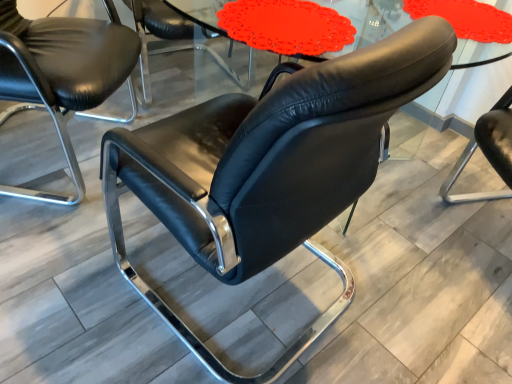
What do you see at coordinates (200, 12) in the screenshot?
I see `matte glass table at center` at bounding box center [200, 12].

What do you see at coordinates (270, 168) in the screenshot?
I see `black leather chair at center, arranged as the 3th chair when viewed from the back` at bounding box center [270, 168].

This screenshot has height=384, width=512. I want to click on matte glass table at center, so click(200, 12).

Does point (279, 59) lie in front of point (194, 46)?

No, it is behind (194, 46).

Between matte glass table at center and black leather chair at center, the third chair in the front-to-back sequence, which one has smaller size?

matte glass table at center is smaller.

Considering the positions of objects matte glass table at center and black leather chair at center, arranged as the 1th chair when viewed from the back, in the image provided, who is in front, matte glass table at center or black leather chair at center, arranged as the 1th chair when viewed from the back,?

matte glass table at center is more forward.

Which is more to the left, black leather chair at left, arranged as the second chair when viewed from the back, or black leather chair at center, arranged as the 1th chair when viewed from the back?

Positioned to the left is black leather chair at left, arranged as the second chair when viewed from the back.

Is black leather chair at left, arranged as the second chair when viewed from the front, turned away from black leather chair at center, the third chair in the front-to-back sequence?

black leather chair at left, arranged as the second chair when viewed from the front, does not have its back to black leather chair at center, the third chair in the front-to-back sequence.

From the image's perspective, is black leather chair at left, arranged as the second chair when viewed from the back, above or below black leather chair at center, the third chair in the front-to-back sequence?

black leather chair at left, arranged as the second chair when viewed from the back, is situated lower than black leather chair at center, the third chair in the front-to-back sequence, in the image.

Where is `the 1st chair below the black leather chair at center, the third chair in the front-to-back sequence (from the image's perspective)`? Image resolution: width=512 pixels, height=384 pixels. the 1st chair below the black leather chair at center, the third chair in the front-to-back sequence (from the image's perspective) is located at coordinates (62, 73).

Between black leather chair at center, arranged as the 3th chair when viewed from the back, and black leather chair at left, arranged as the second chair when viewed from the front, which one has larger width?

Wider between the two is black leather chair at center, arranged as the 3th chair when viewed from the back.

Is black leather chair at center, the 1th chair viewed from the front, turned away from black leather chair at left, arranged as the second chair when viewed from the back?

That's not correct — black leather chair at center, the 1th chair viewed from the front, is not looking away from black leather chair at left, arranged as the second chair when viewed from the back.

Considering the relative positions of black leather chair at center, the 1th chair viewed from the front, and black leather chair at left, arranged as the second chair when viewed from the front, in the image provided, is black leather chair at center, the 1th chair viewed from the front, to the right of black leather chair at left, arranged as the second chair when viewed from the front, from the viewer's perspective?

Indeed, black leather chair at center, the 1th chair viewed from the front, is positioned on the right side of black leather chair at left, arranged as the second chair when viewed from the front.

Does point (335, 311) come behind point (0, 35)?

No, it is not.

From the picture: Between black leather chair at center, the third chair in the front-to-back sequence, and black leather chair at center, arranged as the 3th chair when viewed from the back, which one has larger size?

Bigger between the two is black leather chair at center, arranged as the 3th chair when viewed from the back.

Does black leather chair at center, arranged as the 1th chair when viewed from the back, have a lesser width compared to black leather chair at center, the 1th chair viewed from the front?

Indeed, black leather chair at center, arranged as the 1th chair when viewed from the back, has a lesser width compared to black leather chair at center, the 1th chair viewed from the front.

From the image's perspective, starting from the black leather chair at center, arranged as the 3th chair when viewed from the back, which chair is the 2nd one above? Please provide its 2D coordinates.

[(172, 38)]

Is black leather chair at center, the third chair in the front-to-back sequence, at the left side of black leather chair at center, arranged as the 3th chair when viewed from the back?

Correct, you'll find black leather chair at center, the third chair in the front-to-back sequence, to the left of black leather chair at center, arranged as the 3th chair when viewed from the back.

Is black leather chair at left, arranged as the second chair when viewed from the back, shorter than matte glass table at center?

Incorrect, the height of black leather chair at left, arranged as the second chair when viewed from the back, does not fall short of that of matte glass table at center.

Are black leather chair at left, arranged as the second chair when viewed from the front, and matte glass table at center making contact?

They are not placed beside each other.

Can matte glass table at center be found inside black leather chair at left, arranged as the second chair when viewed from the back?

No, matte glass table at center is not inside black leather chair at left, arranged as the second chair when viewed from the back.

Which is behind, point (178, 9) or point (19, 86)?

Point (178, 9)

Between matte glass table at center and black leather chair at left, arranged as the second chair when viewed from the front, which one has larger width?

Wider between the two is black leather chair at left, arranged as the second chair when viewed from the front.

Does matte glass table at center have a lesser height compared to black leather chair at left, arranged as the second chair when viewed from the front?

Yes.

Is matte glass table at center closer to the viewer compared to black leather chair at left, arranged as the second chair when viewed from the back?

Yes, matte glass table at center is in front of black leather chair at left, arranged as the second chair when viewed from the back.

Which is more to the right, black leather chair at center, arranged as the 1th chair when viewed from the back, or black leather chair at left, arranged as the second chair when viewed from the back?

From the viewer's perspective, black leather chair at center, arranged as the 1th chair when viewed from the back, appears more on the right side.

Do you think black leather chair at center, arranged as the 1th chair when viewed from the back, is within black leather chair at left, arranged as the second chair when viewed from the front, or outside of it?

The correct answer is: outside.

From a real-world perspective, relative to black leather chair at left, arranged as the second chair when viewed from the front, is black leather chair at center, the third chair in the front-to-back sequence, vertically above or below?

From a real-world perspective, black leather chair at center, the third chair in the front-to-back sequence, is physically below black leather chair at left, arranged as the second chair when viewed from the front.

Where is `round table in front of the black leather chair at center, the third chair in the front-to-back sequence`? This screenshot has width=512, height=384. round table in front of the black leather chair at center, the third chair in the front-to-back sequence is located at coordinates (200, 12).

From the image's perspective, which chair is the 1st one below the black leather chair at center, arranged as the 1th chair when viewed from the back? Please provide its 2D coordinates.

[(62, 73)]

When comparing their distances from black leather chair at center, arranged as the 3th chair when viewed from the back, does black leather chair at left, arranged as the second chair when viewed from the front, or black leather chair at center, arranged as the 1th chair when viewed from the back, seem further?

The object further to black leather chair at center, arranged as the 3th chair when viewed from the back, is black leather chair at center, arranged as the 1th chair when viewed from the back.

From the image, which object appears to be farther from matte glass table at center, black leather chair at center, arranged as the 1th chair when viewed from the back, or black leather chair at left, arranged as the second chair when viewed from the front?

black leather chair at left, arranged as the second chair when viewed from the front, lies further to matte glass table at center than the other object.

When comparing their distances from black leather chair at center, arranged as the 3th chair when viewed from the back, does black leather chair at left, arranged as the second chair when viewed from the front, or matte glass table at center seem closer?

black leather chair at left, arranged as the second chair when viewed from the front, is positioned closer to the anchor black leather chair at center, arranged as the 3th chair when viewed from the back.

Estimate the real-world distances between objects in this image. Which object is further from black leather chair at left, arranged as the second chair when viewed from the front, matte glass table at center or black leather chair at center, arranged as the 3th chair when viewed from the back?

black leather chair at center, arranged as the 3th chair when viewed from the back, is further to black leather chair at left, arranged as the second chair when viewed from the front.

Considering their positions, is black leather chair at center, the third chair in the front-to-back sequence, positioned closer to black leather chair at center, the 1th chair viewed from the front, than matte glass table at center?

black leather chair at center, the third chair in the front-to-back sequence.

Estimate the real-world distances between objects in this image. Which object is closer to black leather chair at left, arranged as the second chair when viewed from the back, black leather chair at center, the third chair in the front-to-back sequence, or matte glass table at center?

Among the two, black leather chair at center, the third chair in the front-to-back sequence, is located nearer to black leather chair at left, arranged as the second chair when viewed from the back.

Looking at the image, which one is located closer to black leather chair at center, the third chair in the front-to-back sequence, black leather chair at left, arranged as the second chair when viewed from the back, or matte glass table at center?

matte glass table at center is closer to black leather chair at center, the third chair in the front-to-back sequence.

Based on their spatial positions, is black leather chair at center, arranged as the 3th chair when viewed from the back, or matte glass table at center further from black leather chair at left, arranged as the second chair when viewed from the back?

The object further to black leather chair at left, arranged as the second chair when viewed from the back, is black leather chair at center, arranged as the 3th chair when viewed from the back.

In order to click on chair between black leather chair at center, the 1th chair viewed from the front, and black leather chair at center, arranged as the 1th chair when viewed from the back, from front to back in this screenshot , I will do `click(62, 73)`.

Where is `round table located between black leather chair at center, arranged as the 3th chair when viewed from the back, and black leather chair at center, the third chair in the front-to-back sequence, in the depth direction`? The width and height of the screenshot is (512, 384). round table located between black leather chair at center, arranged as the 3th chair when viewed from the back, and black leather chair at center, the third chair in the front-to-back sequence, in the depth direction is located at coordinates (200, 12).